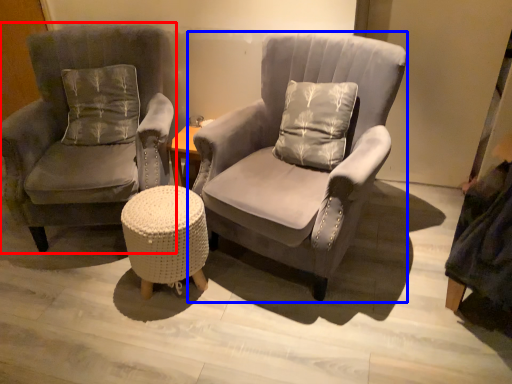
Question: Which object is closer to the camera taking this photo, chair (highlighted by a red box) or chair (highlighted by a blue box)?

Choices:
 (A) chair
 (B) chair

Answer: (B)